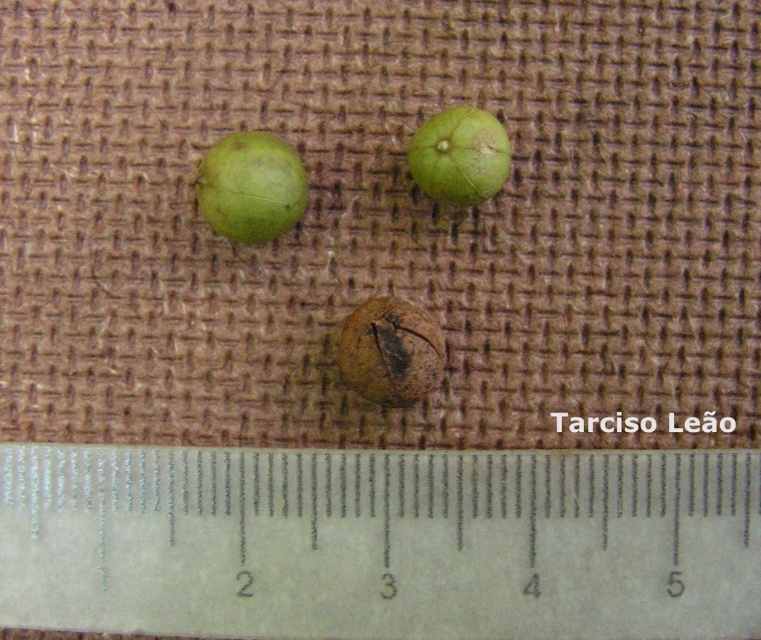
You have a small container that can only fit items wider than 3 centimeters. Looking at the image, can the brown rough seed at center fit into the container if the white plastic ruler at center is used as a reference for width?

The white plastic ruler at center might be wider than brown rough seed at center, so if the ruler is wider than 3 centimeters, the seed might also fit. However, since the exact width of the seed isn

You are a gardener who wants to plant the green matte seed at upper center. You need to know if it will fit into a planting hole that is the same width as the white plastic ruler at center. Can the seed fit into the hole?

The white plastic ruler at center might be wider than the green matte seed at upper center, so the seed may not fit into the hole if the hole is the same width as the ruler.